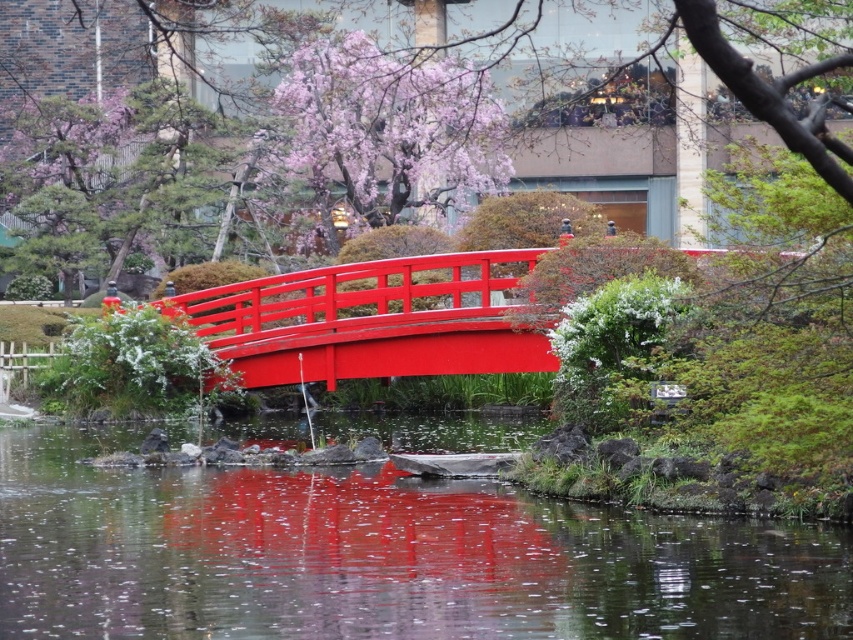
Question: Based on their relative distances, which object is nearer to the transparent water at center?

Choices:
 (A) pink blossoms at upper center
 (B) glossy wood bridge at center

Answer: (B)

Question: Which point is farther to the camera?

Choices:
 (A) (370, 72)
 (B) (738, 570)
 (C) (453, 362)

Answer: (A)

Question: Is the position of transparent water at center less distant than that of pink blossoms at upper center?

Choices:
 (A) no
 (B) yes

Answer: (B)

Question: Is transparent water at center thinner than pink blossoms at upper center?

Choices:
 (A) no
 (B) yes

Answer: (A)

Question: Does glossy wood bridge at center appear on the left side of pink blossoms at upper center?

Choices:
 (A) no
 (B) yes

Answer: (B)

Question: Which of the following is the closest to the observer?

Choices:
 (A) glossy wood bridge at center
 (B) pink blossoms at upper center
 (C) transparent water at center

Answer: (C)